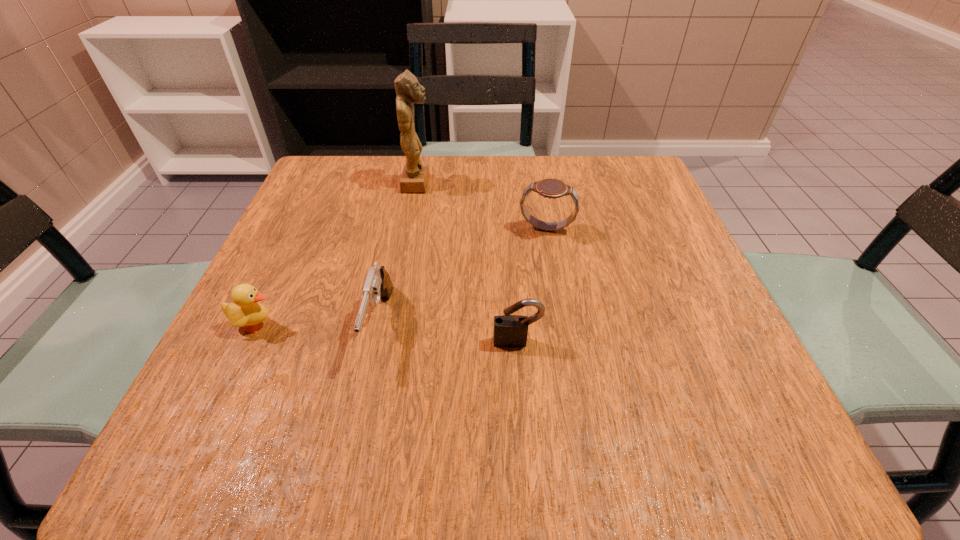
Find the location of `vacant area that lies between the watch and the leftmost object`. vacant area that lies between the watch and the leftmost object is located at coordinates (401, 277).

In order to click on vacant point located between the watch and the figurine in this screenshot , I will do [482, 206].

Where is `vacant area between the duckling and the watch`? The width and height of the screenshot is (960, 540). vacant area between the duckling and the watch is located at coordinates (401, 277).

Locate an element on the screen. This screenshot has width=960, height=540. vacant space that's between the watch and the farthest object is located at coordinates (482, 206).

Find the location of a particular element. Image resolution: width=960 pixels, height=540 pixels. free space between the duckling and the padlock is located at coordinates (387, 333).

At what (x,y) coordinates should I click in order to perform the action: click on vacant area that lies between the gun and the duckling. Please return your answer as a coordinate pair (x, y). Image resolution: width=960 pixels, height=540 pixels. Looking at the image, I should click on (318, 324).

Locate an element on the screen. The height and width of the screenshot is (540, 960). empty space that is in between the second farthest object and the padlock is located at coordinates (532, 286).

Image resolution: width=960 pixels, height=540 pixels. Find the location of `free point between the watch and the gun`. free point between the watch and the gun is located at coordinates (463, 276).

At what (x,y) coordinates should I click in order to perform the action: click on vacant point located between the padlock and the gun. Please return your answer as a coordinate pair (x, y). The image size is (960, 540). Looking at the image, I should click on (448, 333).

The width and height of the screenshot is (960, 540). Identify the location of unoccupied area between the padlock and the watch. (532, 286).